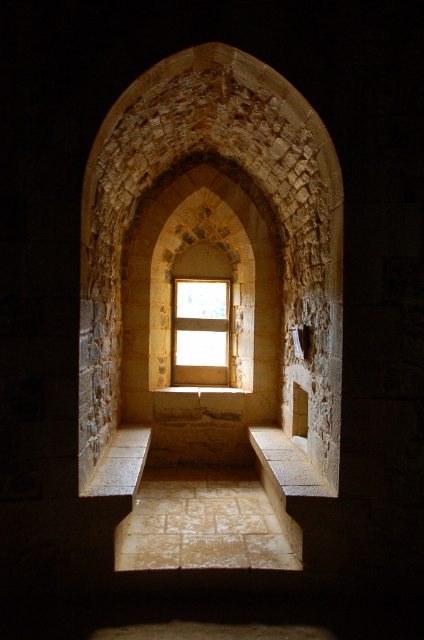
You are an architect examining the stone textured archway at center and the wooden frame window at center in the image. Which object has a greater width according to the description?

The stone textured archway at center has a greater width than the wooden frame window at center, as stated in the description.

You are standing in the narrow arched passageway and want to walk towards the center. Which direction should you move to reach the stone textured archway at center from your current position at point (231, 310)?

The point (231, 310) is already at the center of the stone textured archway, so you are already at the center.